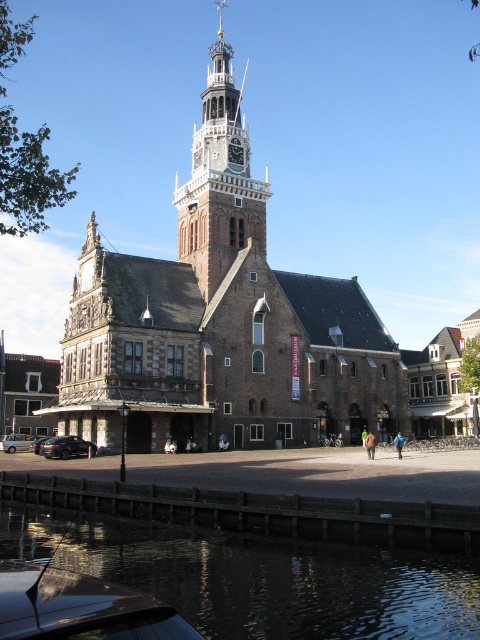
You are an architect designing a new park and want to place a bench between the brown brick church at center and the wooden clock tower at center. Which side of the bench should face the wider structure?

The brown brick church at center is wider than the wooden clock tower at center, so the bench should face the brown brick church at center.

You are standing in front of the historic building and want to take a photo that includes both the clock tower and the dark reflective water at lower left. Where should you position yourself to ensure both elements are in the frame?

Position yourself so that the dark reflective water at lower left is visible in the lower left corner of your camera frame, while the clock tower occupies the central upper portion. Since the dark reflective water at lower left is located at coordinates approximately 0.902 on the x and 0.542 on the y axis, aligning your camera to include this point will ensure both elements are captured.

You are a maintenance worker who needs to inspect both the brown brick church at center and the wooden clock tower at center. Given that you have a ladder that can reach up to 7 meters, can you safely reach both structures with your current equipment?

The brown brick church at center and wooden clock tower at center are 7.42 meters apart. Since your ladder can only reach up to 7 meters, you cannot safely reach both structures with your current equipment as the distance exceeds the ladder capacity.